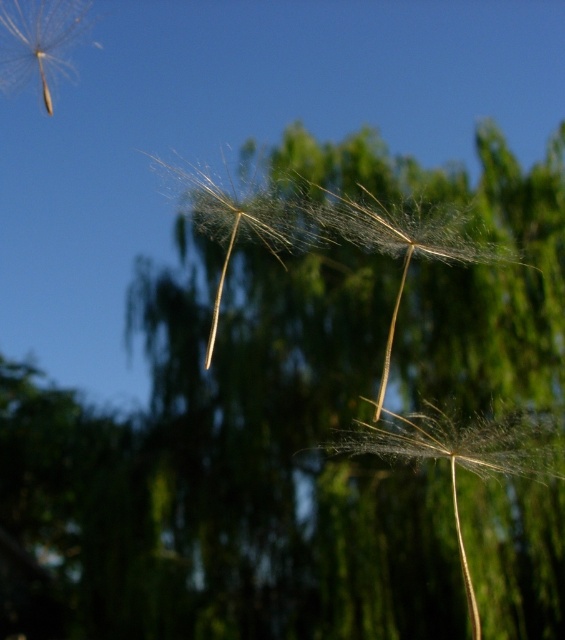
Between translucent fibrous dandelion at center and translucent white dandelion at center, which one has more height?

With more height is translucent fibrous dandelion at center.

Who is more distant from viewer, (541, 419) or (214, 216)?

The point (214, 216) is behind.

Who is more forward, (399, 440) or (212, 349)?

Point (399, 440)

At what (x,y) coordinates should I click in order to perform the action: click on translucent fibrous dandelion at center. Please return your answer as a coordinate pair (x, y). The width and height of the screenshot is (565, 640). Looking at the image, I should click on click(462, 454).

In the scene shown: Can you confirm if translucent white dandelion at center is shorter than transparent white dandelion at upper left?

No.

Does translucent white dandelion at center have a smaller size compared to transparent white dandelion at upper left?

Incorrect, translucent white dandelion at center is not smaller in size than transparent white dandelion at upper left.

Where is `translucent white dandelion at center`? The image size is (565, 640). translucent white dandelion at center is located at coordinates (242, 224).

Measure the distance between point (528, 456) and camera.

The distance of point (528, 456) from camera is 1.90 meters.

Is translucent fibrous dandelion at center smaller than translucent paper dandelion at center?

Incorrect, translucent fibrous dandelion at center is not smaller in size than translucent paper dandelion at center.

Locate an element on the screen. Image resolution: width=565 pixels, height=640 pixels. translucent fibrous dandelion at center is located at coordinates (462, 454).